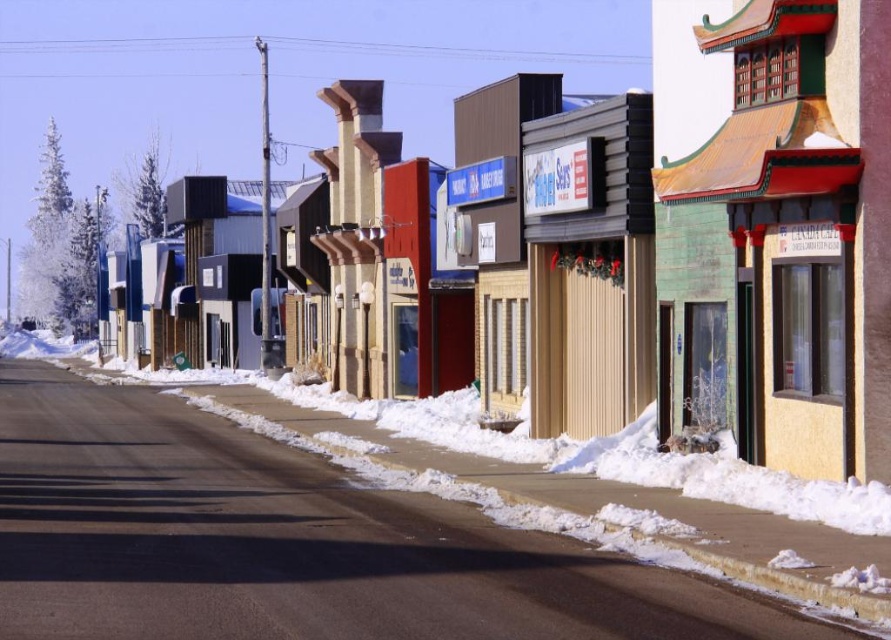
You are a delivery person trying to park your 2.5 meter wide truck on the street. The white powdery snow at center is in the middle of the road. Can you safely park your truck without covering the green wooden building at center?

The white powdery snow at center is wider than the green wooden building at center. Since the snow is in the middle of the road, there might be enough space on either side of the snow to park the truck without covering the building. However, the exact positioning depends on the total width of the road and the distance between the snow and the building.

You are standing at the edge of the road and want to walk to the white powdery snow at center. Based on the scene description, can you determine if the snow is on the sidewalk or the road?

The white powdery snow at center is located at point [288,541], which is on the road since the sidewalk has cleared snow piles and the road has tire tracks. Therefore, the snow is on the road.

You are standing on the sidewalk and looking at the white powdery snow at center and the green wooden building at center. Which one appears nearer to you?

The white powdery snow at center is closer to the viewer than the green wooden building at center, so the snow appears nearer.